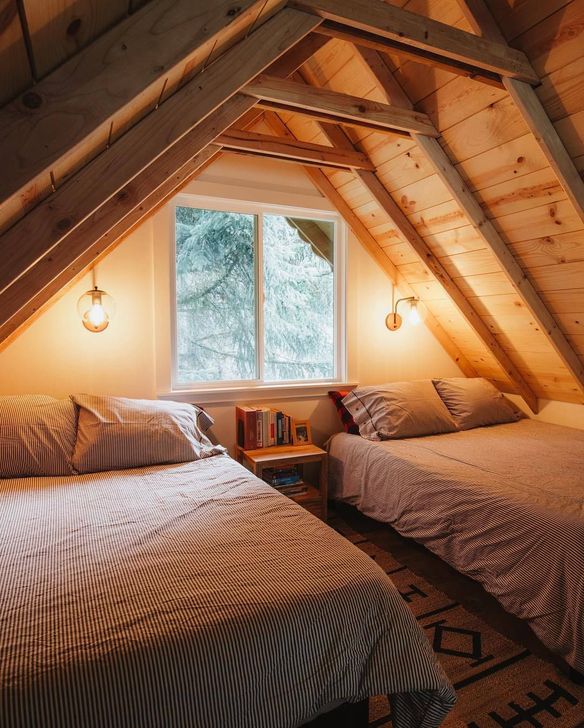
Find the location of a particular element. lightbulbs is located at coordinates (96, 314), (413, 319).